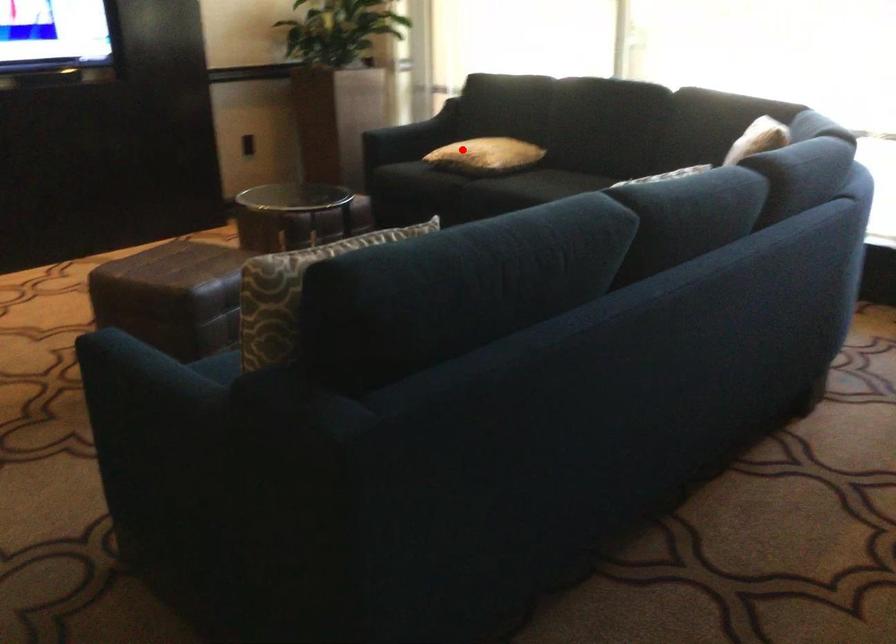
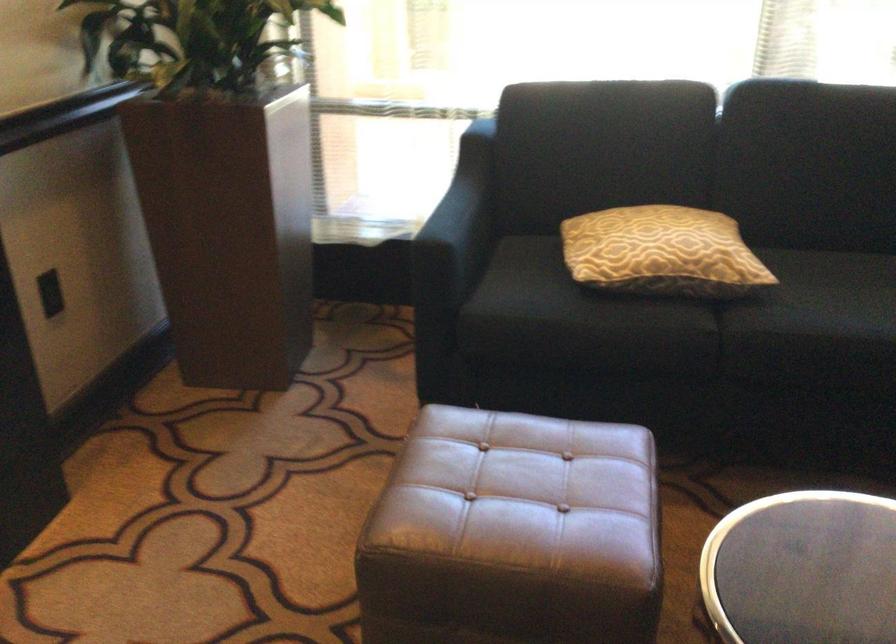
Question: I am providing you with two images of the same scene from different viewpoints. A red point is shown in image1. For the corresponding object point in image2, is it positioned nearer or farther from the camera?

Choices:
 (A) Nearer
 (B) Farther

Answer: (A)